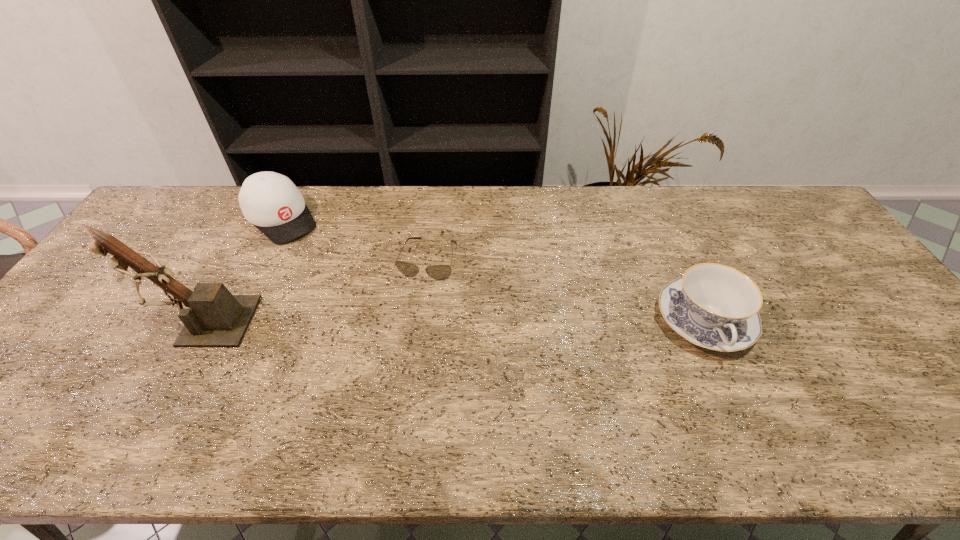
You are a GUI agent. You are given a task and a screenshot of the screen. Output one action in this format:
    pyautogui.click(x=<x>, y=<y>)
    Task: Click on the blank area located on the front-facing side of the shortest object
    The height and width of the screenshot is (540, 960).
    Given the screenshot: What is the action you would take?
    pyautogui.click(x=408, y=326)

At what (x,y) coordinates should I click in order to perform the action: click on blank space located 0.400m on the front-facing side of the baseball cap. Please return your answer as a coordinate pair (x, y). The height and width of the screenshot is (540, 960). Looking at the image, I should click on (371, 310).

In order to click on vacant space located on the front-facing side of the baseball cap in this screenshot , I will do [352, 292].

I want to click on vacant region located 0.400m on the front-facing side of the baseball cap, so click(371, 310).

Where is `object present at the far edge`? object present at the far edge is located at coordinates (270, 201).

At what (x,y) coordinates should I click in order to perform the action: click on free spot at the far edge of the desktop. Please return your answer as a coordinate pair (x, y). The image size is (960, 540). Looking at the image, I should click on (372, 207).

This screenshot has height=540, width=960. I want to click on vacant space at the near edge, so click(155, 383).

This screenshot has height=540, width=960. I want to click on vacant position at the left edge of the desktop, so click(91, 307).

The height and width of the screenshot is (540, 960). Identify the location of free space at the right edge of the desktop. (941, 369).

Locate an element on the screen. blank area at the far right corner is located at coordinates (778, 186).